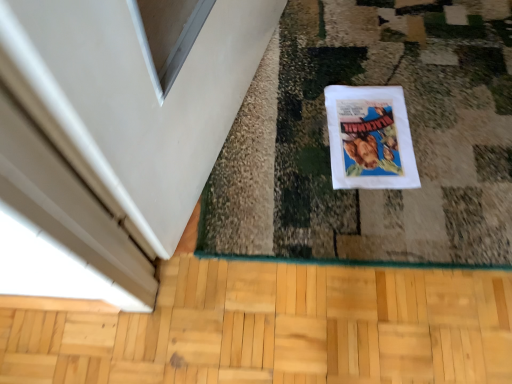
This screenshot has width=512, height=384. What do you see at coordinates (370, 138) in the screenshot?
I see `white paper comic book at center` at bounding box center [370, 138].

I want to click on white paper comic book at center, so [x=370, y=138].

What do you see at coordinates (277, 329) in the screenshot?
I see `light brown wood flooring at lower center` at bounding box center [277, 329].

Where is `light brown wood flooring at lower center`? This screenshot has width=512, height=384. light brown wood flooring at lower center is located at coordinates (277, 329).

At what (x,y) coordinates should I click in order to perform the action: click on white paper comic book at center. Please return your answer as a coordinate pair (x, y). The image size is (512, 384). Looking at the image, I should click on (370, 138).

Can you confirm if white paper comic book at center is positioned to the right of light brown wood flooring at lower center?

Correct, you'll find white paper comic book at center to the right of light brown wood flooring at lower center.

Considering the positions of objects white paper comic book at center and light brown wood flooring at lower center in the image provided, who is behind, white paper comic book at center or light brown wood flooring at lower center?

white paper comic book at center.

Between point (391, 135) and point (113, 346), which one is positioned in front?

Positioned in front is point (113, 346).

From the image's perspective, who appears lower, white paper comic book at center or light brown wood flooring at lower center?

From the image's view, light brown wood flooring at lower center is below.

From a real-world perspective, is white paper comic book at center on light brown wood flooring at lower center?

Yes, from a real-world perspective, white paper comic book at center is on top of light brown wood flooring at lower center.

Which object is thinner, white paper comic book at center or light brown wood flooring at lower center?

light brown wood flooring at lower center is thinner.

From their relative heights in the image, would you say white paper comic book at center is taller or shorter than light brown wood flooring at lower center?

Clearly, white paper comic book at center is shorter compared to light brown wood flooring at lower center.

Considering the sizes of objects white paper comic book at center and light brown wood flooring at lower center in the image provided, who is smaller, white paper comic book at center or light brown wood flooring at lower center?

Smaller between the two is white paper comic book at center.

In the scene shown: Is white paper comic book at center not within light brown wood flooring at lower center?

Yes, white paper comic book at center is not within light brown wood flooring at lower center.

Is there a large distance between white paper comic book at center and light brown wood flooring at lower center?

white paper comic book at center is actually quite close to light brown wood flooring at lower center.

Is white paper comic book at center oriented towards light brown wood flooring at lower center?

Yes, white paper comic book at center is turned towards light brown wood flooring at lower center.

Looking at this image, what's the angular difference between white paper comic book at center and light brown wood flooring at lower center's facing directions?

The facing directions of white paper comic book at center and light brown wood flooring at lower center are 174 degrees apart.

Locate an element on the screen. This screenshot has height=384, width=512. comic book above the light brown wood flooring at lower center (from the image's perspective) is located at coordinates (370, 138).

Between light brown wood flooring at lower center and white paper comic book at center, which one appears on the left side from the viewer's perspective?

light brown wood flooring at lower center is more to the left.

Between light brown wood flooring at lower center and white paper comic book at center, which one is positioned behind?

white paper comic book at center is further away from the camera.

Is point (248, 304) closer or farther from the camera than point (347, 135)?

Point (248, 304) appears to be closer to the viewer than point (347, 135).

From the image's perspective, is light brown wood flooring at lower center above white paper comic book at center?

No, from the image's perspective, light brown wood flooring at lower center is not above white paper comic book at center.

From a real-world perspective, is light brown wood flooring at lower center physically located above or below white paper comic book at center?

In terms of real-world spatial position, light brown wood flooring at lower center is below white paper comic book at center.

Considering the sizes of objects light brown wood flooring at lower center and white paper comic book at center in the image provided, who is wider, light brown wood flooring at lower center or white paper comic book at center?

white paper comic book at center is wider.

Is light brown wood flooring at lower center taller or shorter than white paper comic book at center?

Clearly, light brown wood flooring at lower center is taller compared to white paper comic book at center.

Between light brown wood flooring at lower center and white paper comic book at center, which one has smaller size?

Smaller between the two is white paper comic book at center.

Is white paper comic book at center surrounded by light brown wood flooring at lower center?

No, white paper comic book at center is located outside of light brown wood flooring at lower center.

Consider the image. Is light brown wood flooring at lower center placed right next to white paper comic book at center?

light brown wood flooring at lower center is not next to white paper comic book at center, and they're not touching.

Is light brown wood flooring at lower center positioned with its back to white paper comic book at center?

No, light brown wood flooring at lower center is not facing away from white paper comic book at center.

Consider the image. How different are the orientations of light brown wood flooring at lower center and white paper comic book at center in degrees?

The angular difference between light brown wood flooring at lower center and white paper comic book at center is 174 degrees.

How distant is light brown wood flooring at lower center from white paper comic book at center?

The distance of light brown wood flooring at lower center from white paper comic book at center is 14.76 inches.

This screenshot has height=384, width=512. In order to click on hardwood below the white paper comic book at center (from a real-world perspective) in this screenshot , I will do `click(277, 329)`.

In the image, there is a light brown wood flooring at lower center. At what (x,y) coordinates should I click in order to perform the action: click on comic book above it (from the image's perspective). Please return your answer as a coordinate pair (x, y). The width and height of the screenshot is (512, 384). Looking at the image, I should click on (370, 138).

Identify the location of comic book behind the light brown wood flooring at lower center. (370, 138).